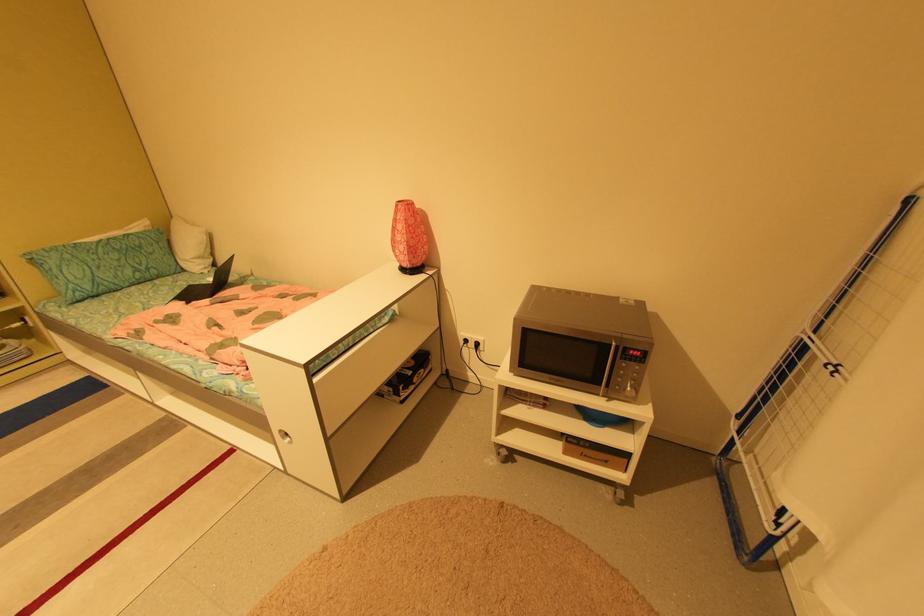
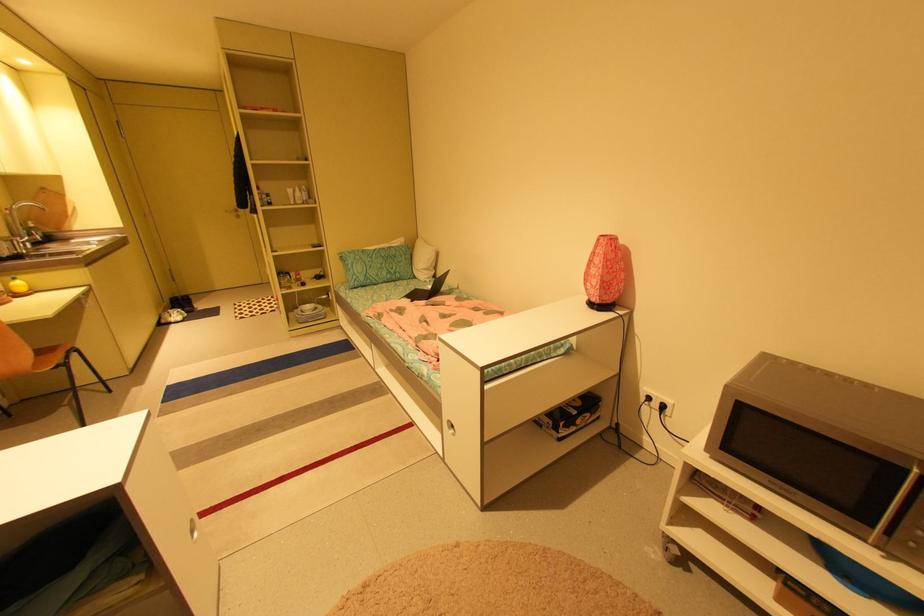
The point at [606,386] is marked in the first image. Where is the corresponding point in the second image?

(879, 528)